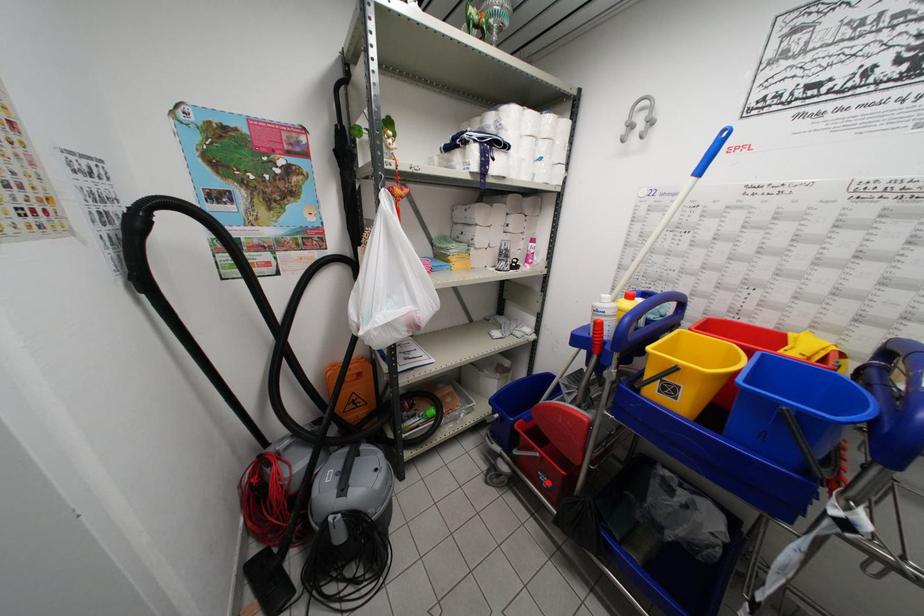
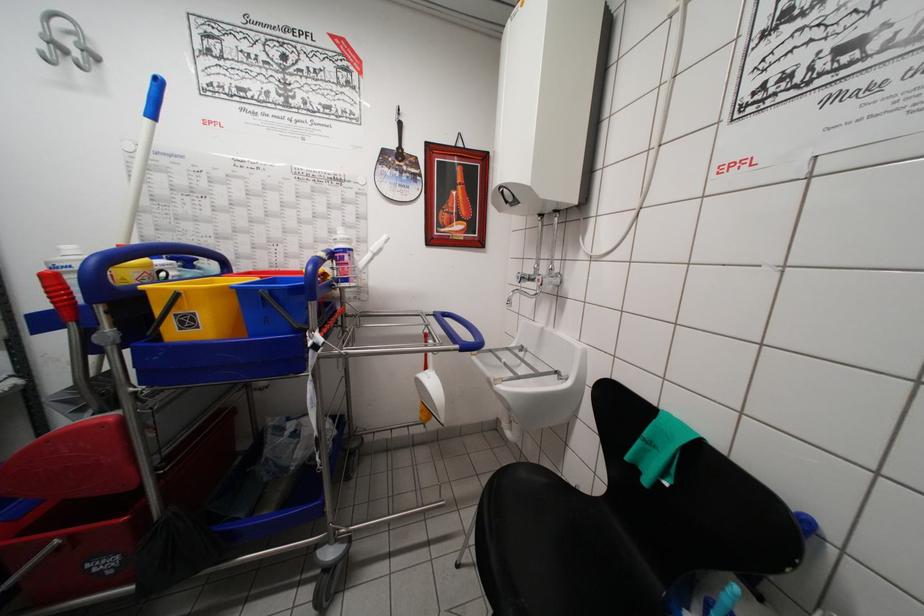
Locate, in the second image, the point that corresponds to the highlighted location in the first image.

(104, 567)